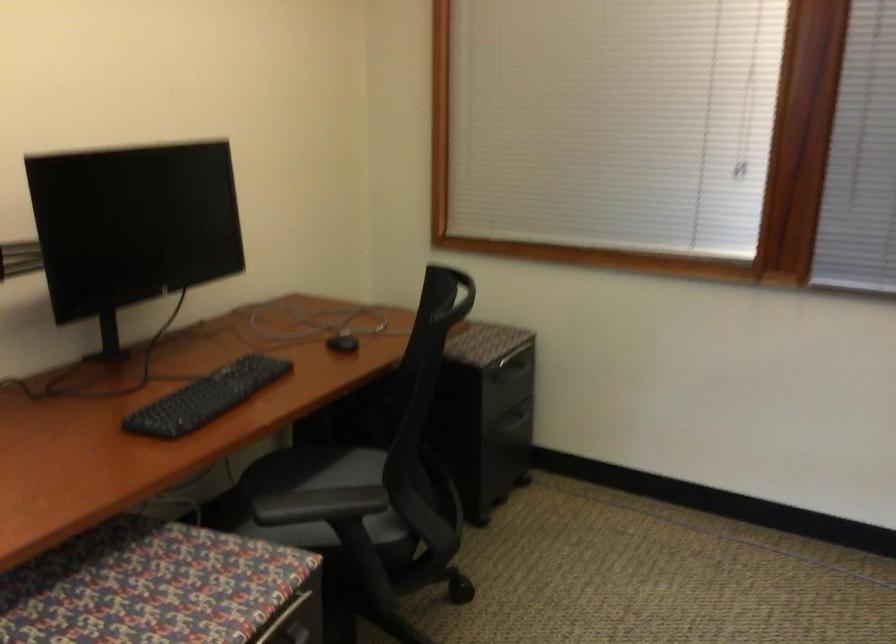
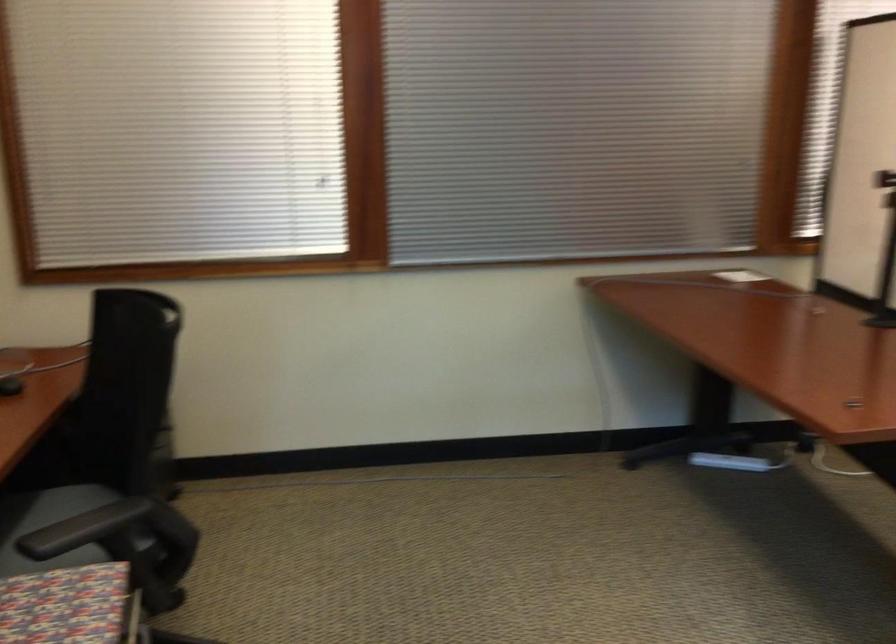
The point at (325, 480) is marked in the first image. Where is the corresponding point in the second image?

(47, 525)